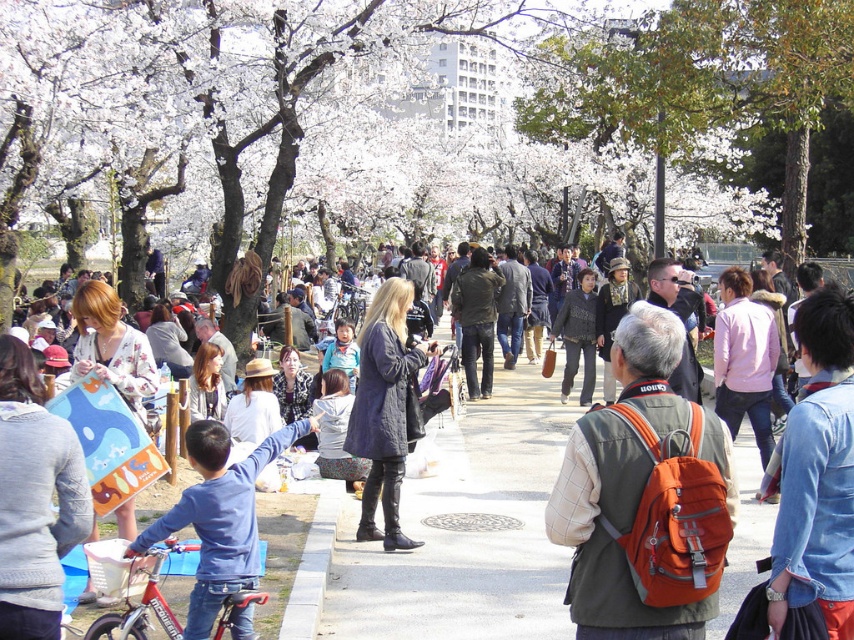
You are a photographer standing at the entrance of the cherry blossom pathway. You want to take a photo that includes both the white blossoms at upper center and the dark brown leather jacket at center. Which object should you adjust your camera angle to focus on first to ensure both are in frame?

The white blossoms at upper center are above the dark brown leather jacket at center, so you should adjust your camera angle to focus on the white blossoms at upper center first to ensure both are in frame.

You are a photographer at the event and want to capture both the denim shirt at center right and the dark gray textured coat at center in the same frame. Which object should you focus on first to ensure both are in the frame?

The denim shirt at center right is smaller than the dark gray textured coat at center, so you should focus on the dark gray textured coat at center first to ensure both are in the frame.